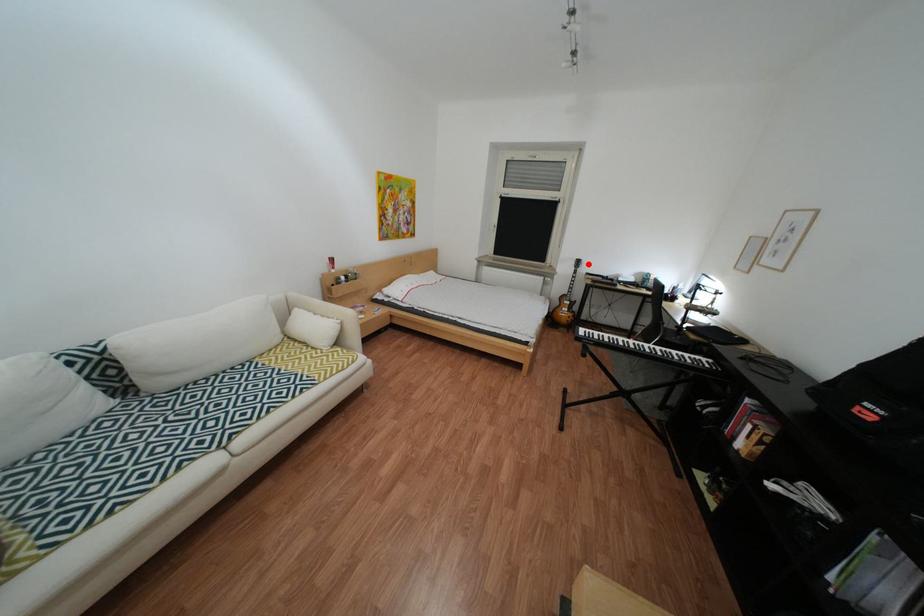
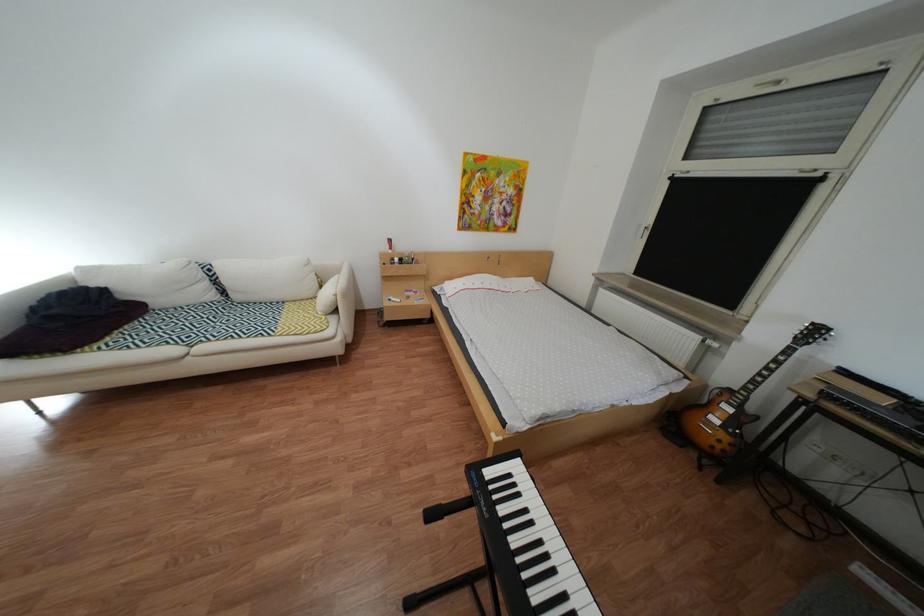
In the second image, find the point that corresponds to the highlighted location in the first image.

(810, 330)